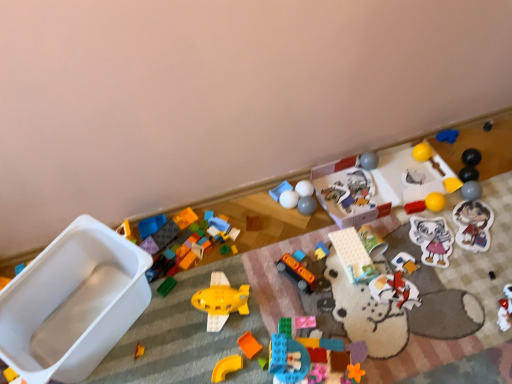
Locate an element on the screen. This screenshot has width=512, height=384. free area in between white matte figure at center, the nineteenth toy viewed from the left, and rubber duck at center, positioned as the 15th toy in left-to-right order is located at coordinates click(x=348, y=267).